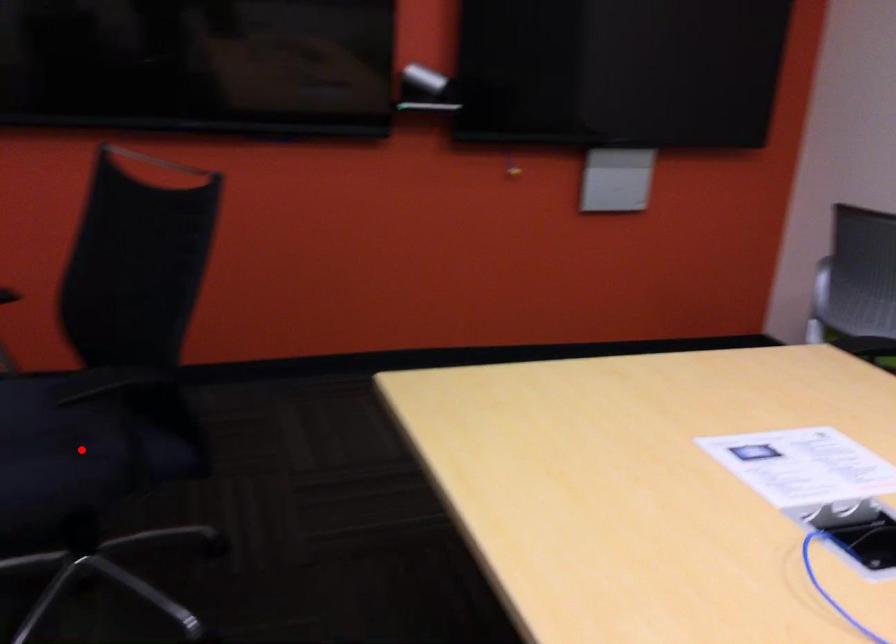
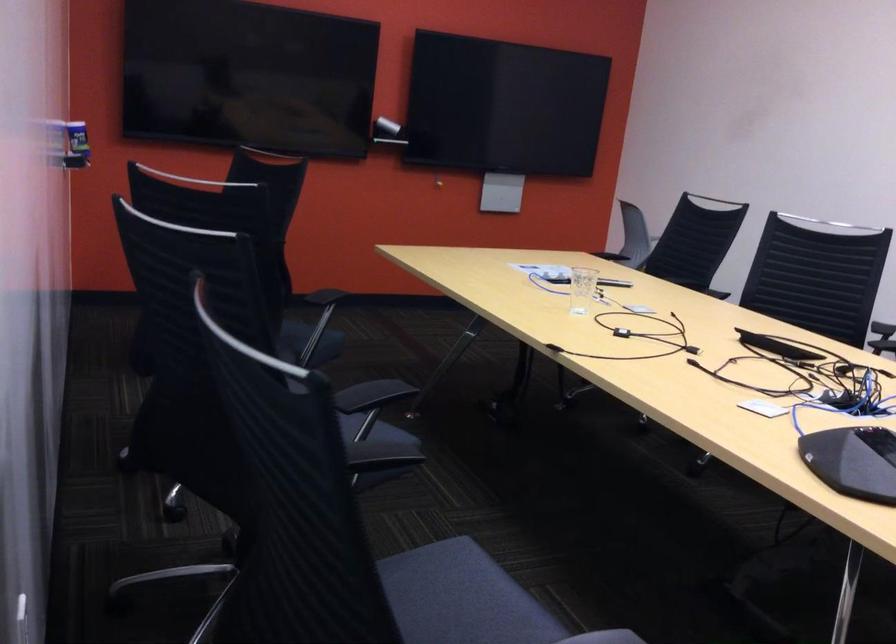
Question: I am providing you with two images of the same scene from different viewpoints. A red point is marked on the first image. Is the red point's position out of view in image 2?

Choices:
 (A) Yes
 (B) No

Answer: (A)